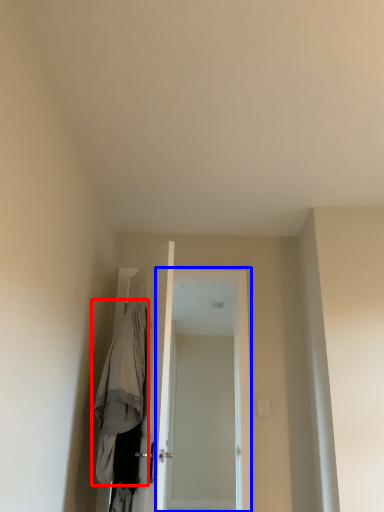
Question: Among these objects, which one is farthest to the camera, robe (highlighted by a red box) or screen door (highlighted by a blue box)?

Choices:
 (A) robe
 (B) screen door

Answer: (B)